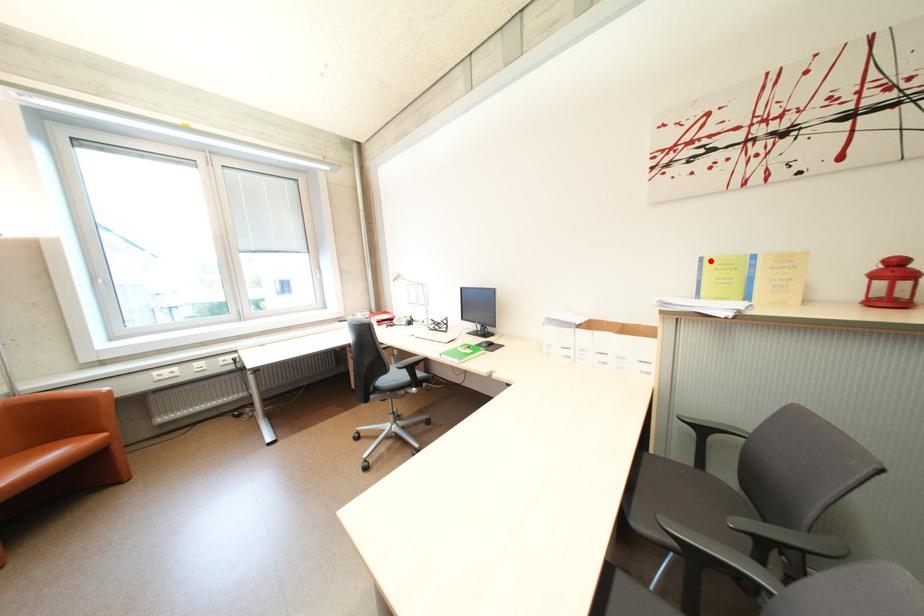
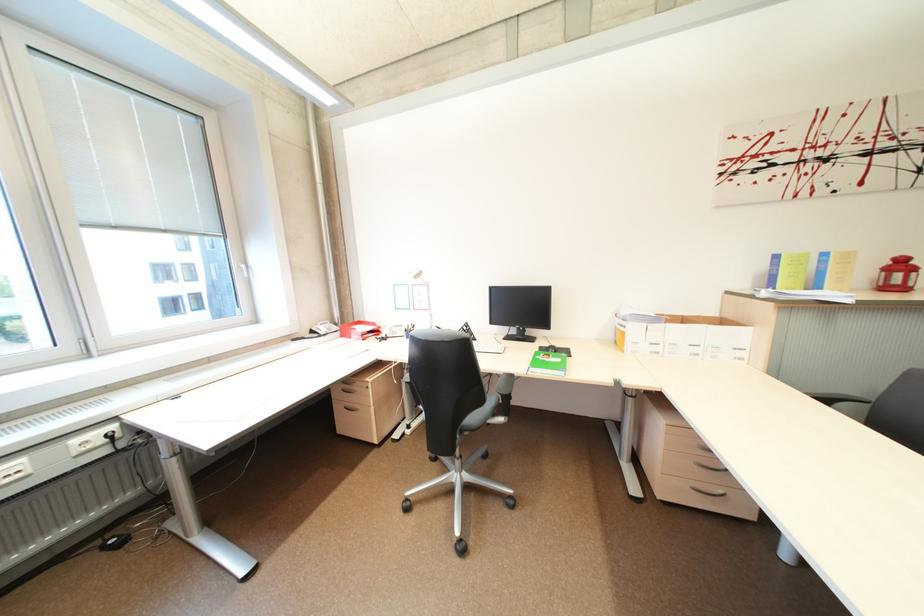
Find the pixel in the second image that matches the highlighted location in the first image.

(785, 257)